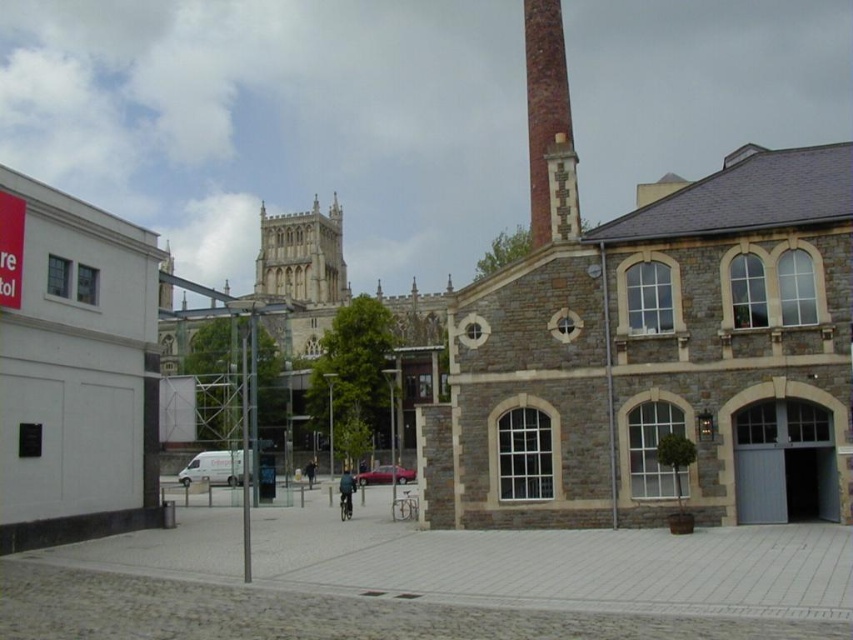
Which is above, stone gothic tower at center or brick chimney at upper right?

stone gothic tower at center

Does stone gothic tower at center have a smaller size compared to brick chimney at upper right?

Actually, stone gothic tower at center might be larger than brick chimney at upper right.

The height and width of the screenshot is (640, 853). I want to click on stone gothic tower at center, so click(300, 257).